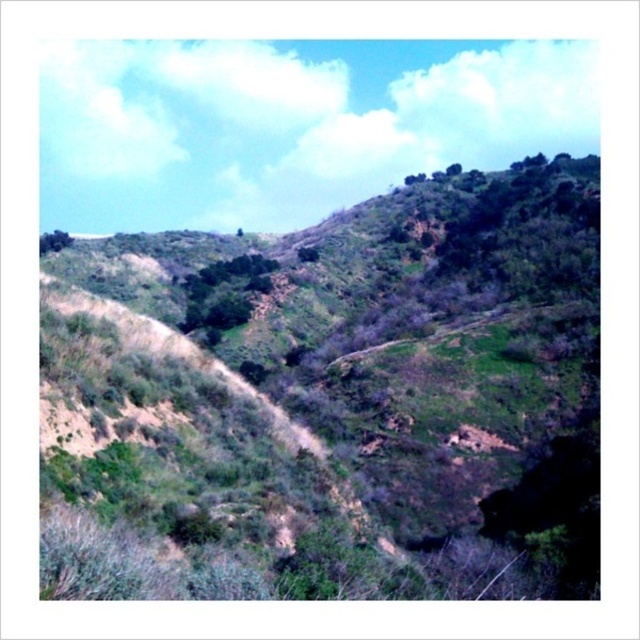
Consider the image. Is green leafy tree at center in front of green leafy tree at upper left?

Yes, green leafy tree at center is in front of green leafy tree at upper left.

Is green leafy tree at center thinner than green leafy tree at upper left?

No, green leafy tree at center is not thinner than green leafy tree at upper left.

Between point (195, 305) and point (44, 241), which one is positioned in front?

Positioned in front is point (195, 305).

Locate an element on the screen. green leafy tree at center is located at coordinates (225, 291).

Who is positioned more to the left, green grassy hillside at center or green leafy tree at center?

green leafy tree at center

Does point (412, 442) come behind point (248, 266)?

No.

This screenshot has height=640, width=640. I want to click on green grassy hillside at center, so click(348, 392).

From the picture: Does green grassy hillside at center have a larger size compared to green leafy tree at upper left?

Yes.

Which of these two, green grassy hillside at center or green leafy tree at upper left, stands shorter?

Standing shorter between the two is green leafy tree at upper left.

The width and height of the screenshot is (640, 640). Identify the location of green grassy hillside at center. (348, 392).

Where is `green grassy hillside at center`? The image size is (640, 640). green grassy hillside at center is located at coordinates [348, 392].